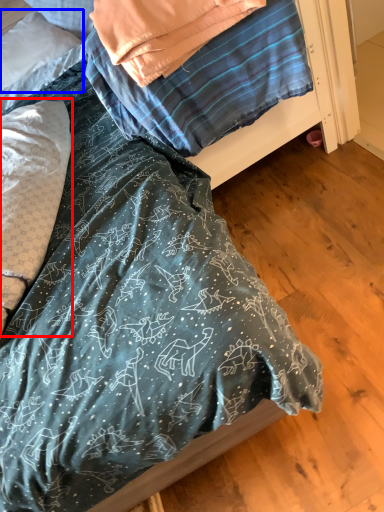
Question: Which point is closer to the camera, pillow (highlighted by a red box) or pillow (highlighted by a blue box)?

Choices:
 (A) pillow
 (B) pillow

Answer: (A)